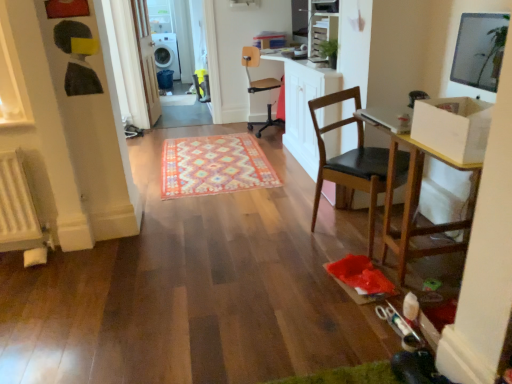
Question: From a real-world perspective, relative to multicolored woven rug at center, is white glossy dishwasher at upper left vertically above or below?

Choices:
 (A) above
 (B) below

Answer: (A)

Question: Looking at their shapes, would you say white glossy dishwasher at upper left is wider or thinner than multicolored woven rug at center?

Choices:
 (A) wide
 (B) thin

Answer: (B)

Question: Which is nearer to the wooden table at right?

Choices:
 (A) white glossy dishwasher at upper left
 (B) beige leather office chair at center, the first chair from the back
 (C) white glossy door at upper left
 (D) black leather chair at center, marked as the 1th chair in a front-to-back arrangement
 (E) multicolored woven rug at center

Answer: (D)

Question: Considering the real-world distances, which object is closest to the beige leather office chair at center, which is counted as the first chair, starting from the top?

Choices:
 (A) black leather chair at center, marked as the 1th chair in a front-to-back arrangement
 (B) white glossy dishwasher at upper left
 (C) white matte radiator at lower left
 (D) wooden table at right
 (E) white glossy door at upper left

Answer: (E)